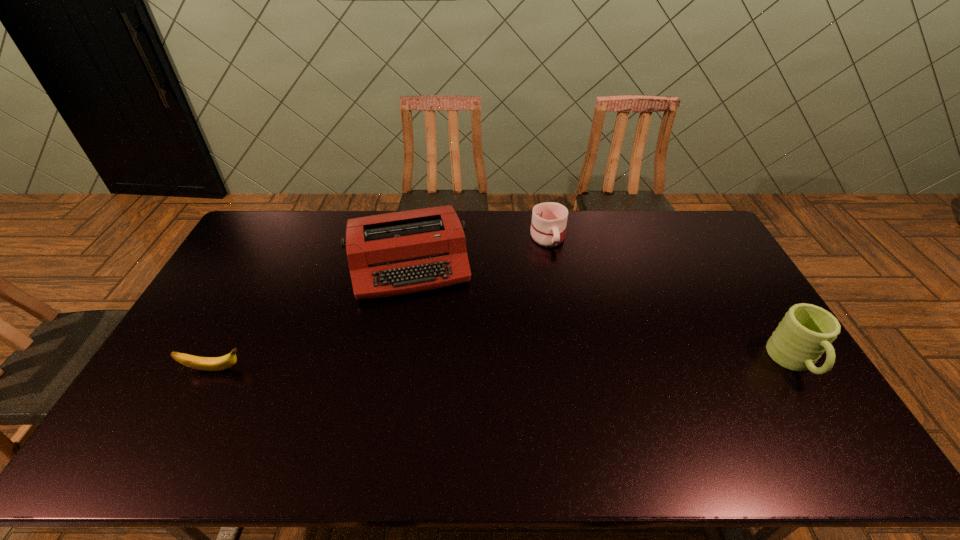
The image size is (960, 540). What are the coordinates of `vacant position located 0.360m on the typing side of the typewriter` in the screenshot? It's located at (439, 399).

Where is `vacant space located on the side with the handle of the farther mug`? This screenshot has height=540, width=960. vacant space located on the side with the handle of the farther mug is located at coordinates click(x=565, y=295).

The height and width of the screenshot is (540, 960). I want to click on free space located 0.060m on the side with the handle of the farther mug, so click(555, 263).

I want to click on free region located 0.080m on the side with the handle of the farther mug, so click(557, 267).

Identify the location of typewriter that is at the far edge. This screenshot has width=960, height=540. (391, 254).

Locate an element on the screen. mug that is positioned at the far edge is located at coordinates (549, 219).

The width and height of the screenshot is (960, 540). Find the location of `object positioned at the near edge`. object positioned at the near edge is located at coordinates (806, 331).

Locate an element on the screen. object that is positioned at the left edge is located at coordinates (201, 363).

Identify the location of object present at the right edge. The width and height of the screenshot is (960, 540). (806, 331).

Identify the location of object located in the near right corner section of the desktop. Image resolution: width=960 pixels, height=540 pixels. (806, 331).